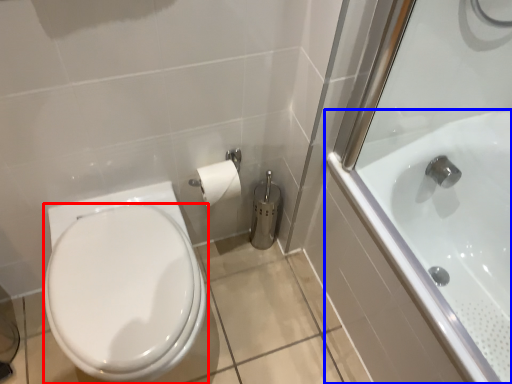
Question: Which object is further to the camera taking this photo, bidet (highlighted by a red box) or bathtub (highlighted by a blue box)?

Choices:
 (A) bidet
 (B) bathtub

Answer: (A)